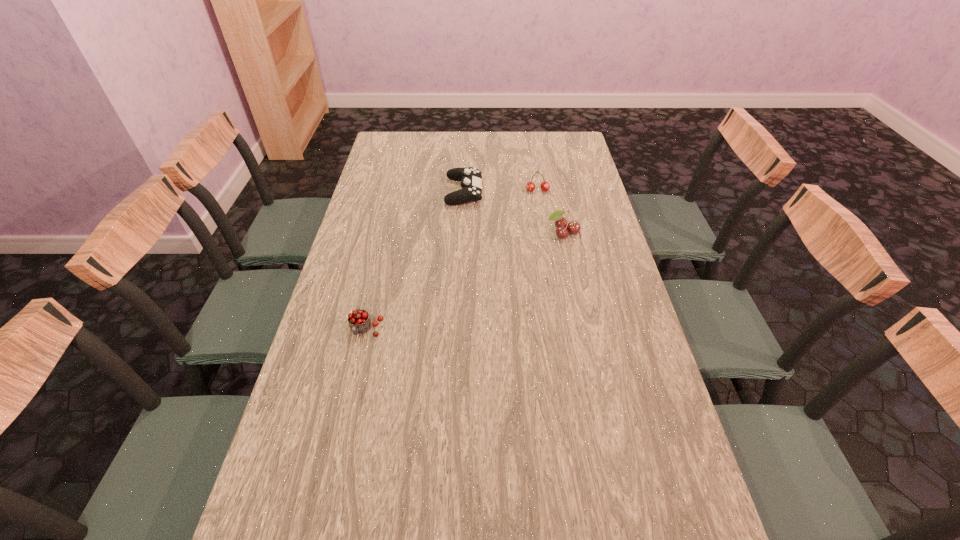
In order to click on free space between the leftmost cherry and the farthest cherry in this screenshot , I will do `click(451, 260)`.

I want to click on vacant area that lies between the farthest cherry and the nearest cherry, so click(451, 260).

This screenshot has height=540, width=960. I want to click on free space between the second nearest object and the leftmost cherry, so (465, 281).

The height and width of the screenshot is (540, 960). I want to click on vacant space that is in between the farthest cherry and the second nearest cherry, so click(x=550, y=212).

I want to click on free spot between the farthest cherry and the leftmost object, so click(451, 260).

Select which object is the closest to the third farthest object. Please provide its 2D coordinates. Your answer should be formatted as a tuple, i.e. [(x, y)], where the tuple contains the x and y coordinates of a point satisfying the conditions above.

[(530, 186)]

The height and width of the screenshot is (540, 960). What are the coordinates of `object that stands as the second closest to the third object from right to left` in the screenshot? It's located at click(573, 227).

Select which cherry is the second closest to the second nearest cherry. Please provide its 2D coordinates. Your answer should be formatted as a tuple, i.e. [(x, y)], where the tuple contains the x and y coordinates of a point satisfying the conditions above.

[(359, 321)]

Select which cherry appears as the third closest to the third object from right to left. Please provide its 2D coordinates. Your answer should be formatted as a tuple, i.e. [(x, y)], where the tuple contains the x and y coordinates of a point satisfying the conditions above.

[(359, 321)]

Image resolution: width=960 pixels, height=540 pixels. I want to click on free spot that satisfies the following two spatial constraints: 1. on the surface of the control; 2. on the handle side of the nearest cherry, so click(x=458, y=330).